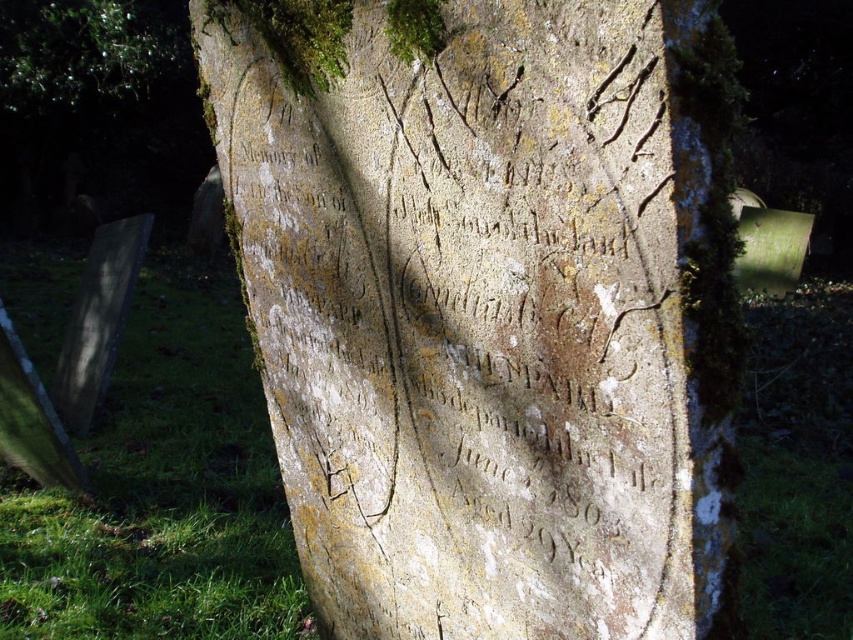
Consider the image. You are standing in a cemetery and see the weathered stone gravestone at center and the green mossy tree at upper left. Which object is positioned to the right of the other?

The weathered stone gravestone at center is to the right of green mossy tree at upper left.